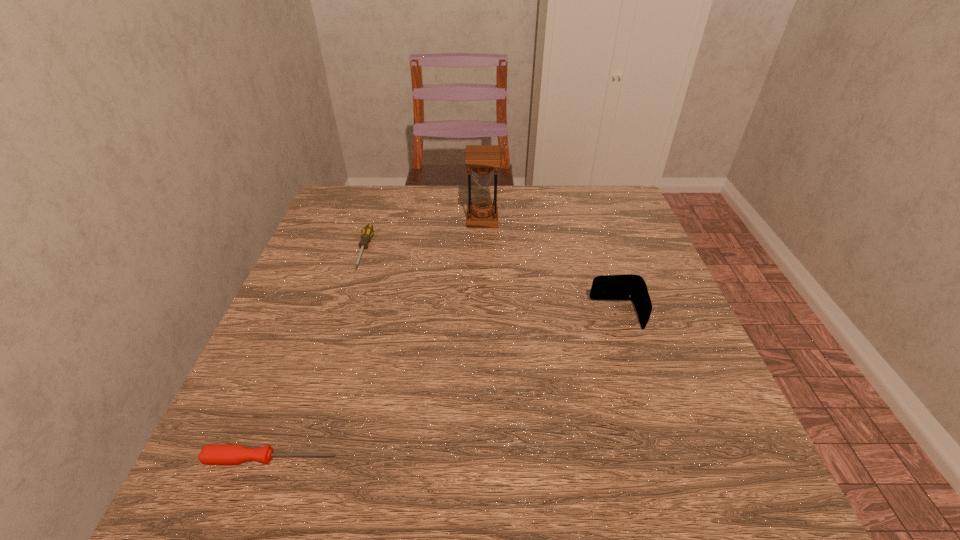
I want to click on free space at the far edge, so click(x=538, y=199).

What are the coordinates of `blank space at the near edge of the desktop` in the screenshot? It's located at [642, 485].

Identify the location of vacant space at the left edge. The image size is (960, 540). (350, 248).

You are a GUI agent. You are given a task and a screenshot of the screen. Output one action in this format:
    pyautogui.click(x=<x>, y=<y>)
    Task: Click on the free region at the right edge of the desktop
    
    Given the screenshot: What is the action you would take?
    pyautogui.click(x=617, y=326)

Locate an element on the screen. This screenshot has width=960, height=540. free location at the near left corner is located at coordinates (197, 478).

Where is `free region at the far right corner of the desktop`? The width and height of the screenshot is (960, 540). free region at the far right corner of the desktop is located at coordinates (614, 187).

Where is `vacant space at the near right corner of the desktop`? The width and height of the screenshot is (960, 540). vacant space at the near right corner of the desktop is located at coordinates (660, 481).

Where is `free space between the hourglass and the shortest object`? The width and height of the screenshot is (960, 540). free space between the hourglass and the shortest object is located at coordinates (376, 339).

Identify the location of unoccupied area between the second nearest object and the farther screwdriver. (491, 282).

At what (x,y) coordinates should I click in order to perform the action: click on free area in between the nearest object and the rightmost object. Please return your answer as a coordinate pair (x, y). The image size is (960, 540). Looking at the image, I should click on (444, 387).